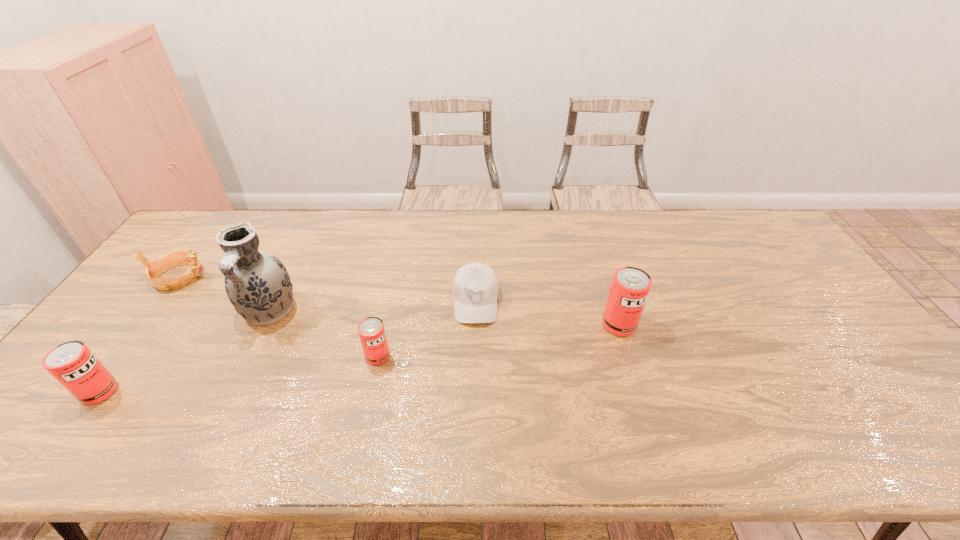
Locate an element on the screen. This screenshot has width=960, height=540. free point at the far edge is located at coordinates (711, 219).

The width and height of the screenshot is (960, 540). Find the location of `vacant space at the near edge of the desktop`. vacant space at the near edge of the desktop is located at coordinates (341, 383).

Where is `vacant region at the right edge of the desktop`? Image resolution: width=960 pixels, height=540 pixels. vacant region at the right edge of the desktop is located at coordinates (814, 277).

Identify the location of free space at the far left corner of the desktop. The image size is (960, 540). (210, 233).

The image size is (960, 540). I want to click on blank space at the near left corner, so click(53, 401).

In the image, there is a desktop. Where is `vacant space at the far right corner`? The image size is (960, 540). vacant space at the far right corner is located at coordinates (736, 220).

Where is `free space between the rightmost object and the tallest object`? free space between the rightmost object and the tallest object is located at coordinates (444, 318).

The width and height of the screenshot is (960, 540). I want to click on free point between the nearest can and the tiara, so click(139, 334).

The image size is (960, 540). In order to click on empty space that is in between the fourth object from left to right and the second tallest object in this screenshot , I will do `click(498, 340)`.

Identify the location of vacant space that is in between the nearest can and the tiara. (139, 334).